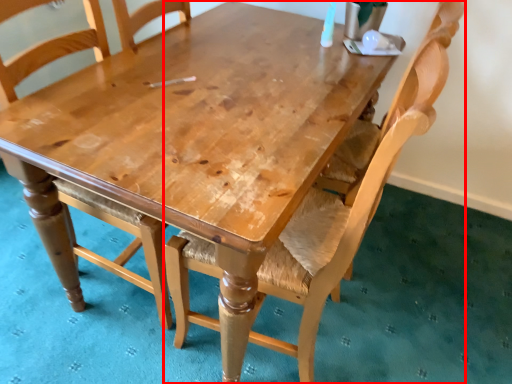
Question: From the image's perspective, where is chair (annotated by the red box) located relative to chair?

Choices:
 (A) below
 (B) above

Answer: (A)